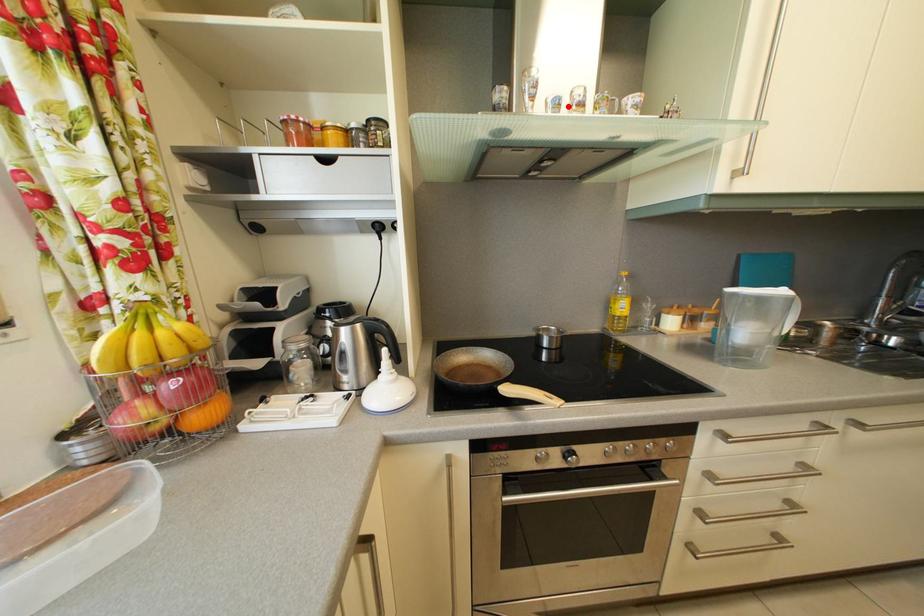
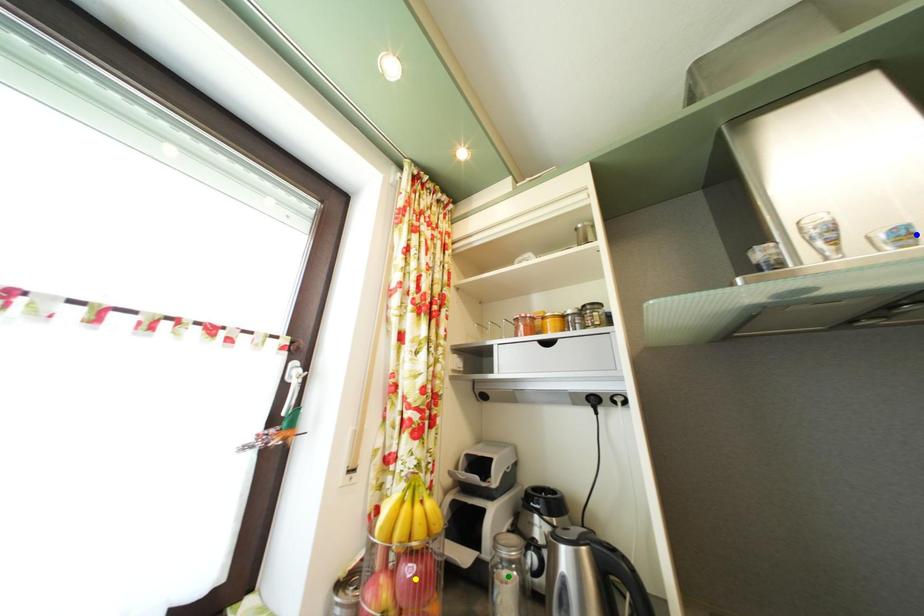
Question: I am providing you with two images of the same scene from different viewpoints. A red point is marked on the first image. You are given multiple points on the second image. In image 2, which mark is for the same physical point as the one in image 1?

Choices:
 (A) blue point
 (B) green point
 (C) yellow point

Answer: (A)